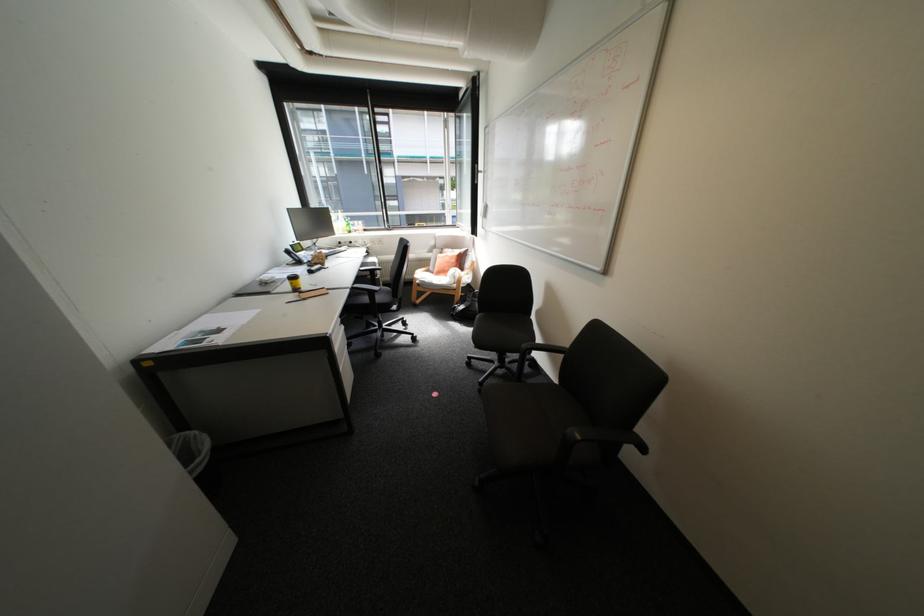
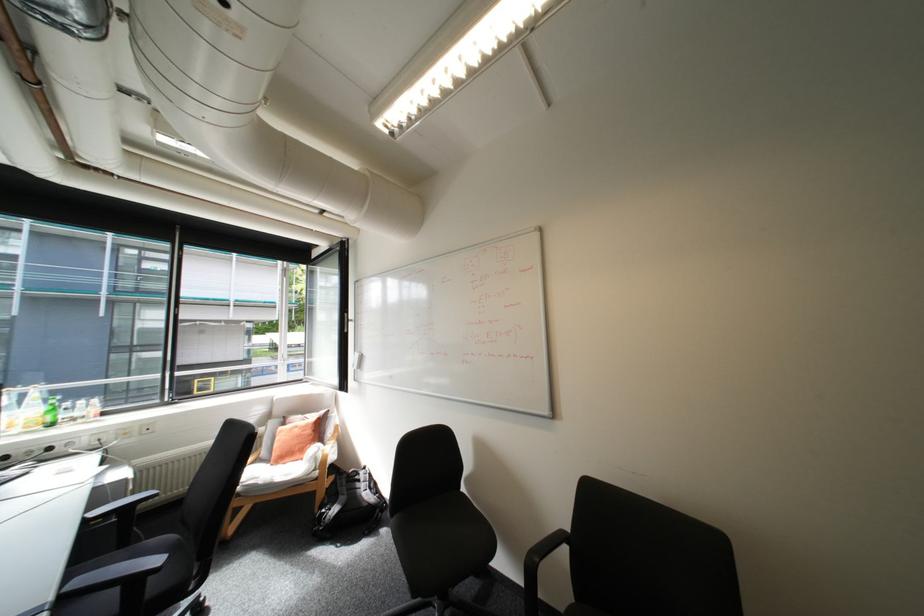
Find the pixel in the second image that matches point (359, 286) in the first image.

(61, 598)